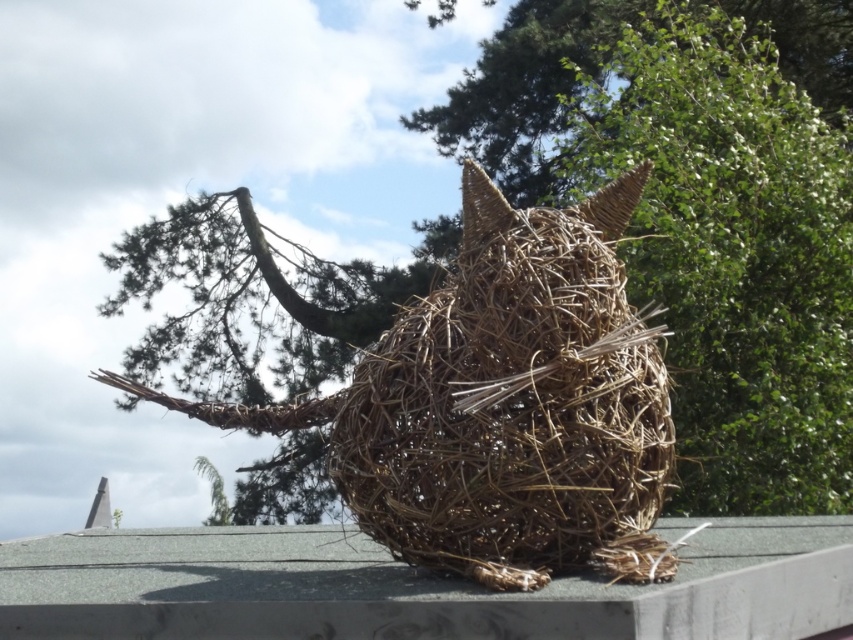
Does braided straw cat at center have a lesser height compared to smooth concrete ledge at center?

Incorrect, braided straw cat at center's height does not fall short of smooth concrete ledge at center's.

Does braided straw cat at center have a smaller size compared to smooth concrete ledge at center?

Correct, braided straw cat at center occupies less space than smooth concrete ledge at center.

Describe the element at coordinates (503, 404) in the screenshot. Image resolution: width=853 pixels, height=640 pixels. I see `braided straw cat at center` at that location.

Locate an element on the screen. braided straw cat at center is located at coordinates (503, 404).